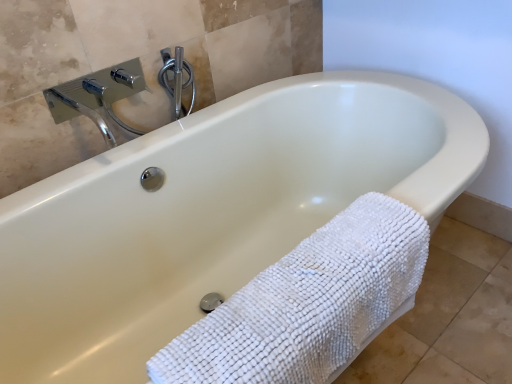
Question: Can you confirm if polished chrome shower at upper center is smaller than white textured towel at lower right?

Choices:
 (A) no
 (B) yes

Answer: (B)

Question: From the image's perspective, would you say polished chrome shower at upper center is positioned over white textured towel at lower right?

Choices:
 (A) yes
 (B) no

Answer: (A)

Question: Is polished chrome shower at upper center oriented away from white textured towel at lower right?

Choices:
 (A) yes
 (B) no

Answer: (B)

Question: Would you say polished chrome shower at upper center contains white textured towel at lower right?

Choices:
 (A) no
 (B) yes

Answer: (A)

Question: Are polished chrome shower at upper center and white textured towel at lower right beside each other?

Choices:
 (A) no
 (B) yes

Answer: (A)

Question: Does polished chrome shower at upper center have a larger size compared to white textured towel at lower right?

Choices:
 (A) yes
 (B) no

Answer: (B)

Question: Is white textured towel at lower right aimed at polished chrome shower at upper center?

Choices:
 (A) no
 (B) yes

Answer: (A)

Question: Is white textured towel at lower right taller than polished chrome shower at upper center?

Choices:
 (A) yes
 (B) no

Answer: (A)

Question: Is white textured towel at lower right shorter than polished chrome shower at upper center?

Choices:
 (A) no
 (B) yes

Answer: (A)

Question: From the image's perspective, is white textured towel at lower right over polished chrome shower at upper center?

Choices:
 (A) yes
 (B) no

Answer: (B)

Question: Is white textured towel at lower right thinner than polished chrome shower at upper center?

Choices:
 (A) no
 (B) yes

Answer: (A)

Question: Are white textured towel at lower right and polished chrome shower at upper center located far from each other?

Choices:
 (A) yes
 (B) no

Answer: (B)

Question: From the image's perspective, relative to polished chrome shower at upper center, is white textured towel at lower right above or below?

Choices:
 (A) below
 (B) above

Answer: (A)